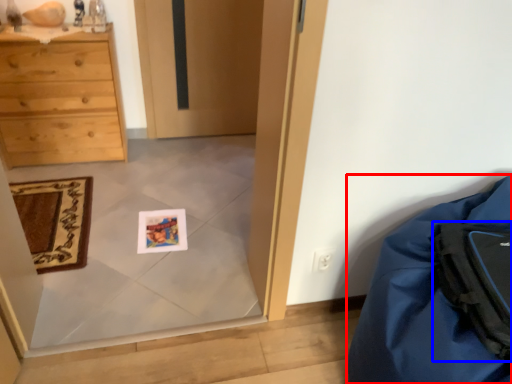
Question: Which of the following is the closest to the observer, furniture (highlighted by a red box) or backpack (highlighted by a blue box)?

Choices:
 (A) furniture
 (B) backpack

Answer: (A)